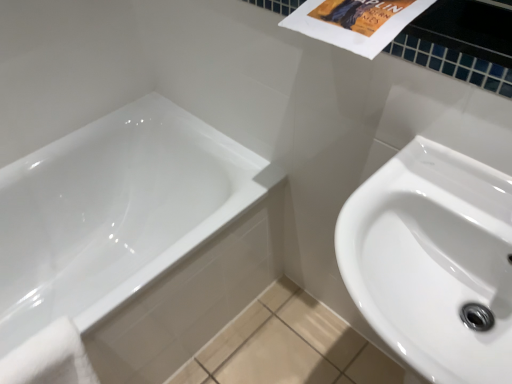
Question: Can you confirm if white glossy bathtub at lower left is wider than white glossy sink at right?

Choices:
 (A) yes
 (B) no

Answer: (A)

Question: Considering the relative sizes of white glossy bathtub at lower left and white glossy sink at right in the image provided, is white glossy bathtub at lower left thinner than white glossy sink at right?

Choices:
 (A) no
 (B) yes

Answer: (A)

Question: Considering the relative sizes of white glossy bathtub at lower left and white glossy sink at right in the image provided, is white glossy bathtub at lower left taller than white glossy sink at right?

Choices:
 (A) yes
 (B) no

Answer: (A)

Question: Considering the relative positions of white glossy bathtub at lower left and white glossy sink at right in the image provided, is white glossy bathtub at lower left behind white glossy sink at right?

Choices:
 (A) yes
 (B) no

Answer: (A)

Question: From a real-world perspective, is white glossy bathtub at lower left over white glossy sink at right?

Choices:
 (A) yes
 (B) no

Answer: (B)

Question: Does white glossy bathtub at lower left have a smaller size compared to white glossy sink at right?

Choices:
 (A) no
 (B) yes

Answer: (A)

Question: From the image's perspective, does white glossy sink at right appear higher than white glossy bathtub at lower left?

Choices:
 (A) yes
 (B) no

Answer: (B)

Question: Is white glossy sink at right turned away from white glossy bathtub at lower left?

Choices:
 (A) yes
 (B) no

Answer: (B)

Question: Is white glossy sink at right at the left side of white glossy bathtub at lower left?

Choices:
 (A) no
 (B) yes

Answer: (A)

Question: Is the position of white glossy sink at right more distant than that of white glossy bathtub at lower left?

Choices:
 (A) no
 (B) yes

Answer: (A)

Question: Would you say white glossy sink at right is outside white glossy bathtub at lower left?

Choices:
 (A) yes
 (B) no

Answer: (A)

Question: Can you confirm if white glossy sink at right is bigger than white glossy bathtub at lower left?

Choices:
 (A) no
 (B) yes

Answer: (A)

Question: Can you confirm if white soft towel at lower left is thinner than white glossy bathtub at lower left?

Choices:
 (A) no
 (B) yes

Answer: (B)